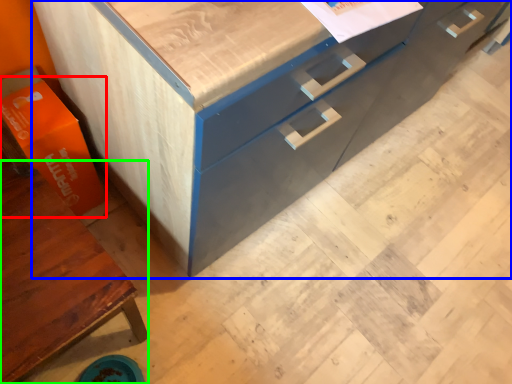
Question: Based on their relative distances, which object is nearer to cardboard box (highlighted by a red box)? Choose from chest of drawers (highlighted by a blue box) and cabinetry (highlighted by a green box).

Choices:
 (A) chest of drawers
 (B) cabinetry

Answer: (B)